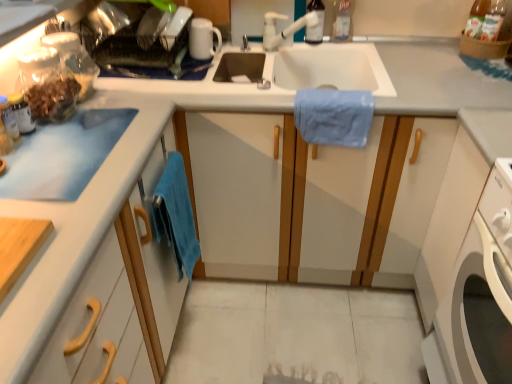
Where is `white matte cabinet at left`? This screenshot has width=512, height=384. white matte cabinet at left is located at coordinates (95, 266).

What do you see at coordinates (476, 275) in the screenshot?
I see `white plastic washing machine at lower right` at bounding box center [476, 275].

Image resolution: width=512 pixels, height=384 pixels. What do you see at coordinates (333, 116) in the screenshot?
I see `blue cotton towel at center, which is counted as the first bath towel, starting from the right` at bounding box center [333, 116].

Image resolution: width=512 pixels, height=384 pixels. What do you see at coordinates (176, 214) in the screenshot? I see `blue cotton towel at lower left, which ranks as the second bath towel in right-to-left order` at bounding box center [176, 214].

Where is `white matte cabinet at left`? This screenshot has width=512, height=384. white matte cabinet at left is located at coordinates (95, 266).

Considering the positions of objects white glossy mug at upper center and white plastic faucet at upper center in the image provided, who is in front, white glossy mug at upper center or white plastic faucet at upper center?

white plastic faucet at upper center is in front.

Considering the sizes of objects white glossy mug at upper center and white plastic faucet at upper center in the image provided, who is shorter, white glossy mug at upper center or white plastic faucet at upper center?

white glossy mug at upper center.

The height and width of the screenshot is (384, 512). Identify the location of appliance below the white plastic faucet at upper center (from a real-world perspective). (203, 39).

Is white plastic faucet at upper center surrounded by white glossy mug at upper center?

No, white plastic faucet at upper center is not inside white glossy mug at upper center.

Can you confirm if transparent plastic bottle at upper center, the first bottle from the left, is bigger than translucent plastic bottle at upper center, positioned as the 1th bottle in right-to-left order?

Correct, transparent plastic bottle at upper center, the first bottle from the left, is larger in size than translucent plastic bottle at upper center, positioned as the 1th bottle in right-to-left order.

Considering the relative sizes of transparent plastic bottle at upper center, the first bottle from the left, and translucent plastic bottle at upper center, which appears as the second bottle when viewed from the left, in the image provided, is transparent plastic bottle at upper center, the first bottle from the left, wider than translucent plastic bottle at upper center, which appears as the second bottle when viewed from the left,?

No.

From the image's perspective, between transparent plastic bottle at upper center, which is counted as the 2th bottle, starting from the right, and translucent plastic bottle at upper center, which appears as the second bottle when viewed from the left, who is located below?

transparent plastic bottle at upper center, which is counted as the 2th bottle, starting from the right.

At what (x,y) coordinates should I click in order to perform the action: click on bottle that is on the right side of transparent plastic bottle at upper center, the first bottle from the left. Please return your answer as a coordinate pair (x, y). The width and height of the screenshot is (512, 384). Looking at the image, I should click on (343, 20).

Based on their sizes in the image, would you say white matte cabinet at left is bigger or smaller than white glossy mug at upper center?

white matte cabinet at left is bigger than white glossy mug at upper center.

Which object is closer to the camera, white matte cabinet at left or white glossy mug at upper center?

white matte cabinet at left is closer to the camera.

In the scene shown: Could you tell me if white matte cabinet at left is facing white glossy mug at upper center?

No, white matte cabinet at left is not oriented towards white glossy mug at upper center.

Considering the relative sizes of white glossy mug at upper center and matte plastic container at upper left in the image provided, is white glossy mug at upper center smaller than matte plastic container at upper left?

Yes.

From the image's perspective, which object appears higher, white glossy mug at upper center or matte plastic container at upper left?

white glossy mug at upper center is shown above in the image.

Is white glossy mug at upper center next to matte plastic container at upper left?

There is a gap between white glossy mug at upper center and matte plastic container at upper left.

Which is behind, point (190, 54) or point (63, 6)?

The point (190, 54) is farther from the camera.

Is white glossy mug at upper center positioned far away from white matte cabinet at left?

white glossy mug at upper center is actually quite close to white matte cabinet at left.

Does white glossy mug at upper center turn towards white matte cabinet at left?

No, white glossy mug at upper center is not facing towards white matte cabinet at left.

From the image's perspective, is white glossy mug at upper center over white matte cabinet at left?

Yes, from the image's perspective, white glossy mug at upper center is on top of white matte cabinet at left.

Does white plastic washing machine at lower right have a greater height compared to blue cotton towel at lower left, the 2th bath towel in the top-to-bottom sequence?

Indeed, white plastic washing machine at lower right has a greater height compared to blue cotton towel at lower left, the 2th bath towel in the top-to-bottom sequence.

From the image's perspective, is white plastic washing machine at lower right on blue cotton towel at lower left, which is counted as the 1th bath towel, starting from the bottom?

No, from the image's perspective, white plastic washing machine at lower right is not over blue cotton towel at lower left, which is counted as the 1th bath towel, starting from the bottom.

Considering the positions of objects white plastic washing machine at lower right and blue cotton towel at lower left, which is counted as the 1th bath towel, starting from the bottom, in the image provided, who is more to the left, white plastic washing machine at lower right or blue cotton towel at lower left, which is counted as the 1th bath towel, starting from the bottom,?

blue cotton towel at lower left, which is counted as the 1th bath towel, starting from the bottom, is more to the left.

From the picture: Is blue cotton towel at lower left, the 2th bath towel in the top-to-bottom sequence, inside white plastic washing machine at lower right?

No, white plastic washing machine at lower right does not contain blue cotton towel at lower left, the 2th bath towel in the top-to-bottom sequence.

Is transparent plastic bottle at upper center, which is counted as the 2th bottle, starting from the right, taller or shorter than white plastic faucet at upper center?

transparent plastic bottle at upper center, which is counted as the 2th bottle, starting from the right, is taller than white plastic faucet at upper center.

Considering the sizes of objects transparent plastic bottle at upper center, the first bottle from the left, and white plastic faucet at upper center in the image provided, who is thinner, transparent plastic bottle at upper center, the first bottle from the left, or white plastic faucet at upper center?

transparent plastic bottle at upper center, the first bottle from the left, is thinner.

Based on the photo, can you tell me how much transparent plastic bottle at upper center, the first bottle from the left, and white plastic faucet at upper center differ in facing direction?

They differ by 53.9 degrees in their facing directions.

Image resolution: width=512 pixels, height=384 pixels. Identify the location of appliance on the left of white plastic faucet at upper center. (203, 39).

Identify the location of bottle below the translucent plastic bottle at upper center, positioned as the 1th bottle in right-to-left order (from the image's perspective). (316, 25).

Considering their positions, is transparent plastic bottle at upper center, which is counted as the 2th bottle, starting from the right, positioned closer to white glossy mug at upper center than white plastic washing machine at lower right?

Based on the image, transparent plastic bottle at upper center, which is counted as the 2th bottle, starting from the right, appears to be nearer to white glossy mug at upper center.

Considering their positions, is white plastic faucet at upper center positioned further to white matte cabinet at left than transparent plastic bottle at upper center, the first bottle from the left?

transparent plastic bottle at upper center, the first bottle from the left, is further to white matte cabinet at left.

Estimate the real-world distances between objects in this image. Which object is closer to white plastic washing machine at lower right, matte plastic container at upper left or blue cotton towel at center, which is the 2th bath towel in bottom-to-top order?

blue cotton towel at center, which is the 2th bath towel in bottom-to-top order.

Estimate the real-world distances between objects in this image. Which object is further from white matte cabinet at left, blue cotton towel at center, which appears as the second bath towel when viewed from the left, or white glossy mug at upper center?

white glossy mug at upper center lies further to white matte cabinet at left than the other object.

Which object lies nearer to the anchor point white matte cabinet at left, white plastic washing machine at lower right or white glossy mug at upper center?

The object closer to white matte cabinet at left is white glossy mug at upper center.

Considering their positions, is matte plastic container at upper left positioned further to white glossy mug at upper center than translucent plastic bottle at upper center, which appears as the second bottle when viewed from the left?

translucent plastic bottle at upper center, which appears as the second bottle when viewed from the left, is further to white glossy mug at upper center.

When comparing their distances from transparent plastic bottle at upper center, the first bottle from the left, does matte plastic container at upper left or white plastic faucet at upper center seem closer?

The object closer to transparent plastic bottle at upper center, the first bottle from the left, is white plastic faucet at upper center.

Considering their positions, is white matte cabinet at left positioned further to transparent plastic bottle at upper center, which is counted as the 2th bottle, starting from the right, than matte plastic container at upper left?

Based on the image, white matte cabinet at left appears to be further to transparent plastic bottle at upper center, which is counted as the 2th bottle, starting from the right.

Find the location of a particular element. The width and height of the screenshot is (512, 384). cabinetry between transparent plastic bottle at upper center, the first bottle from the left, and white plastic washing machine at lower right vertically is located at coordinates (95, 266).

I want to click on bath towel between translucent plastic bottle at upper center, positioned as the 1th bottle in right-to-left order, and blue cotton towel at lower left, the 1th bath towel from the left, in the vertical direction, so click(333, 116).

Find the location of a particular element. Image resolution: width=512 pixels, height=384 pixels. bath towel between matte plastic container at upper left and blue cotton towel at center, which is counted as the first bath towel, starting from the right, in the horizontal direction is located at coordinates (176, 214).

You are a GUI agent. You are given a task and a screenshot of the screen. Output one action in this format:
    pyautogui.click(x=<x>, y=<y>)
    Task: Click on the faucet situated between matte plastic container at upper left and transparent plastic bottle at upper center, which is counted as the 2th bottle, starting from the right, from left to right
    The height and width of the screenshot is (384, 512).
    Given the screenshot: What is the action you would take?
    pyautogui.click(x=285, y=28)